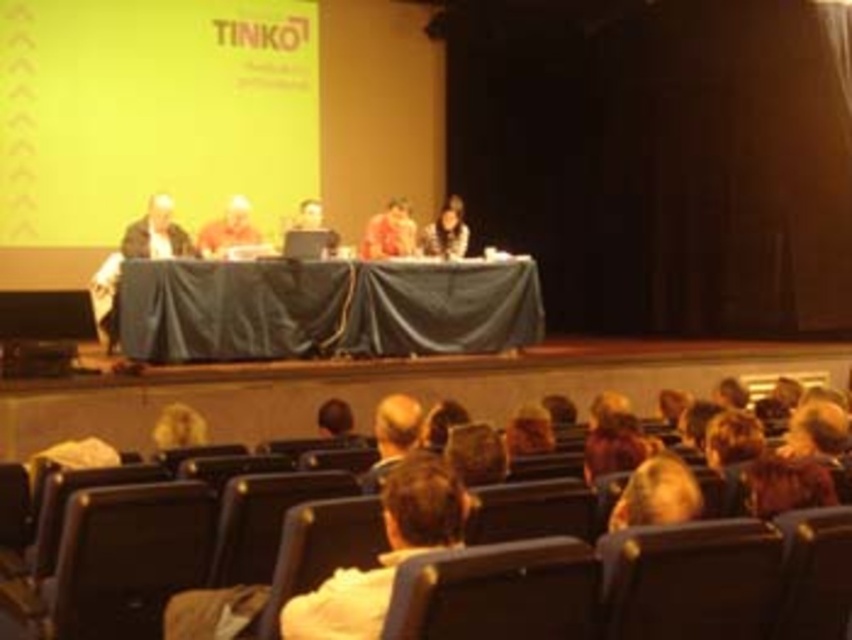
Is orange fabric at center shorter than matte black laptop at center?

Yes.

Can you confirm if orange fabric at center is thinner than matte black laptop at center?

No.

Does point (398, 230) lie in front of point (453, 227)?

That is True.

I want to click on orange fabric at center, so click(x=389, y=232).

Measure the distance between black leather chair at lower right and orange fabric at center.

24.03 feet

Is the position of black leather chair at lower right less distant than that of orange fabric at center?

Yes, it is.

This screenshot has height=640, width=852. What do you see at coordinates (689, 580) in the screenshot? I see `black leather chair at lower right` at bounding box center [689, 580].

This screenshot has height=640, width=852. Identify the location of black leather chair at lower right. (689, 580).

Locate an element on the screen. The width and height of the screenshot is (852, 640). matte gold hair at center is located at coordinates (228, 228).

Between point (200, 244) and point (435, 240), which one is positioned in front?

Point (200, 244) is more forward.

In order to click on matte gold hair at center in this screenshot , I will do `click(228, 228)`.

Find the location of a particular element. matte gold hair at center is located at coordinates (228, 228).